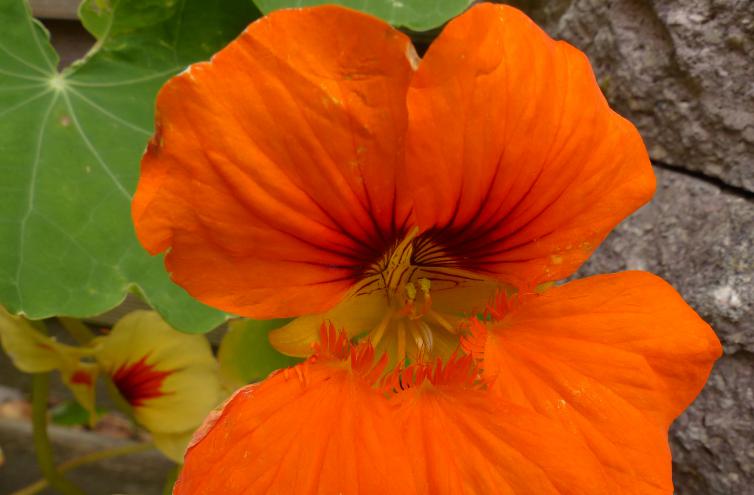
Identify the location of wall. (648, 69).